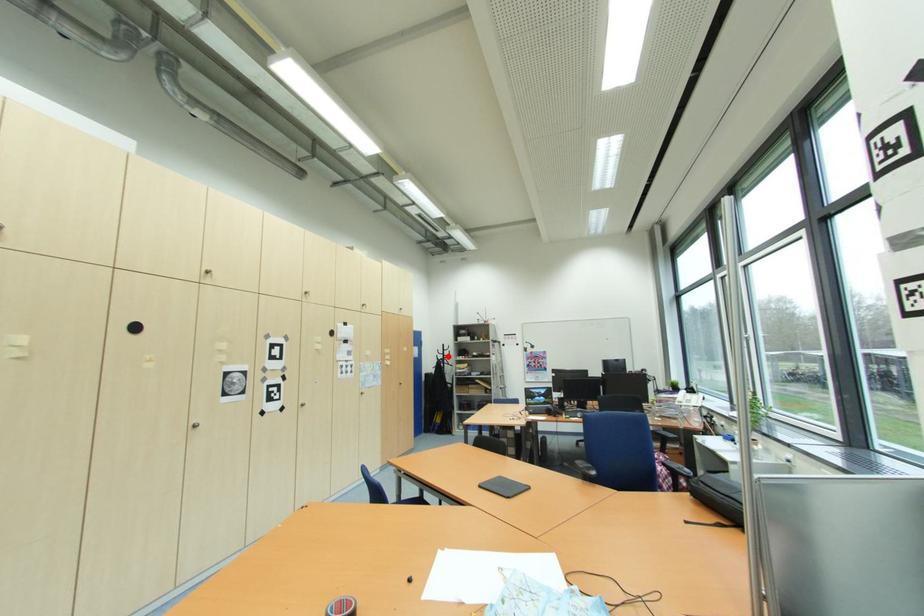
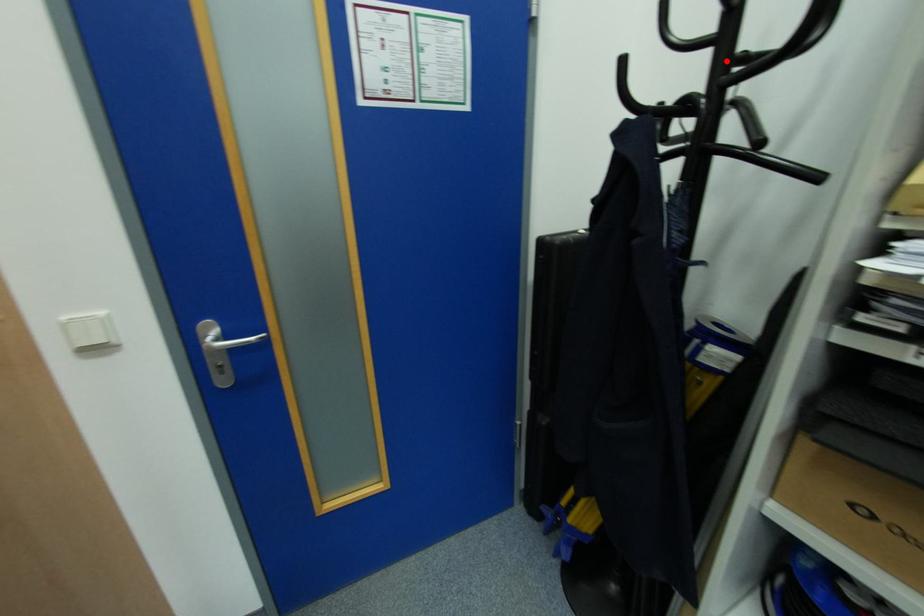
I am providing you with two images of the same scene from different viewpoints. A red point is marked on the first image and another point is marked on the second image. Is the red point in image1 aligned with the point shown in image2?

Yes